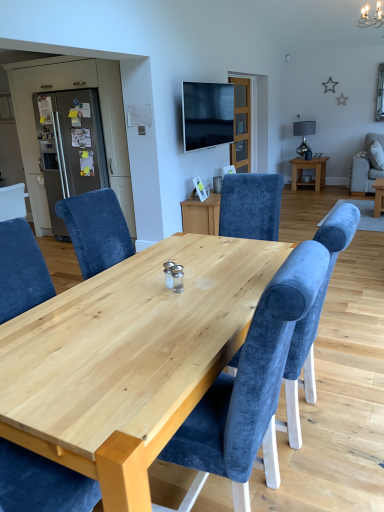
Locate an element on the screen. blank space above natural wood table at center (from a real-world perspective) is located at coordinates (160, 304).